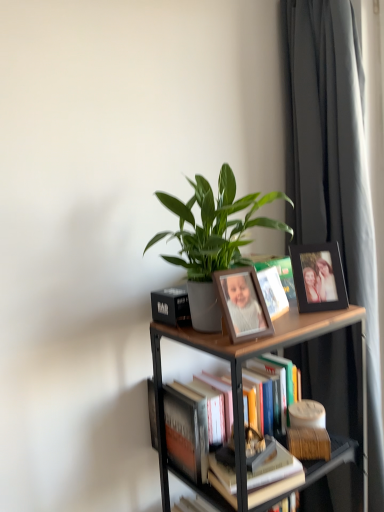
What do you see at coordinates (273, 292) in the screenshot? The height and width of the screenshot is (512, 384). I see `matte white book at center` at bounding box center [273, 292].

The width and height of the screenshot is (384, 512). Describe the element at coordinates (318, 277) in the screenshot. I see `black matte picture frame at upper right, positioned as the first picture frame in back-to-front order` at that location.

This screenshot has height=512, width=384. Describe the element at coordinates (213, 239) in the screenshot. I see `green matte plant at center` at that location.

In order to face woodenmaterial/textureshelf at upper center, should I rotate leftwards or rightwards?

It's best to rotate right around 9.128 degrees.

The image size is (384, 512). Describe the element at coordinates (274, 476) in the screenshot. I see `hardcover book at center, positioned as the 1th book in front-to-back order` at that location.

The width and height of the screenshot is (384, 512). Describe the element at coordinates (243, 304) in the screenshot. I see `wooden photo frame at center, which ranks as the first picture frame in left-to-right order` at that location.

This screenshot has width=384, height=512. Describe the element at coordinates (333, 169) in the screenshot. I see `dark gray fabric curtain at right` at that location.

What is the approximate width of dark gray fabric curtain at right?

The width of dark gray fabric curtain at right is 37.48 centimeters.

Locate an element on the screen. The image size is (384, 512). matte white book at center is located at coordinates (273, 292).

Are hardcover books at center, the 2th book when ordered from front to back, and wooden photo frame at center, the 1th picture frame positioned from the front, beside each other?

No, hardcover books at center, the 2th book when ordered from front to back, is not touching wooden photo frame at center, the 1th picture frame positioned from the front.

Between hardcover books at center, which is counted as the first book, starting from the back, and wooden photo frame at center, the 1th picture frame positioned from the front, which one has smaller width?

With smaller width is wooden photo frame at center, the 1th picture frame positioned from the front.

Could you tell me if hardcover books at center, which is counted as the first book, starting from the back, is turned towards wooden photo frame at center, which appears as the 2th picture frame when viewed from the back?

No, hardcover books at center, which is counted as the first book, starting from the back, is not aimed at wooden photo frame at center, which appears as the 2th picture frame when viewed from the back.

Is green matte plant at center completely or partially inside hardcover book at center, which is counted as the second book, starting from the back?

No, green matte plant at center is not a part of hardcover book at center, which is counted as the second book, starting from the back.

Is hardcover book at center, which is counted as the second book, starting from the back, looking in the opposite direction of green matte plant at center?

hardcover book at center, which is counted as the second book, starting from the back, does not have its back to green matte plant at center.

Looking at their sizes, would you say hardcover book at center, which is counted as the second book, starting from the back, is wider or thinner than green matte plant at center?

Considering their sizes, hardcover book at center, which is counted as the second book, starting from the back, looks slimmer than green matte plant at center.

Is hardcover books at center, the 2th book when ordered from front to back, turned away from matte white book at center?

No, matte white book at center is not at the back of hardcover books at center, the 2th book when ordered from front to back.

From the picture: Is matte white book at center completely or partially inside hardcover books at center, which is counted as the first book, starting from the back?

That's incorrect, matte white book at center is not inside hardcover books at center, which is counted as the first book, starting from the back.

Is hardcover books at center, which is counted as the first book, starting from the back, positioned behind matte white book at center?

Yes, hardcover books at center, which is counted as the first book, starting from the back, is behind matte white book at center.

Which of these two, hardcover books at center, which is counted as the first book, starting from the back, or matte white book at center, is thinner?

Thinner between the two is matte white book at center.

Considering the relative sizes of wooden photo frame at center, which ranks as the first picture frame in left-to-right order, and hardcover book at center, which is counted as the second book, starting from the back, in the image provided, is wooden photo frame at center, which ranks as the first picture frame in left-to-right order, wider than hardcover book at center, which is counted as the second book, starting from the back,?

No, wooden photo frame at center, which ranks as the first picture frame in left-to-right order, is not wider than hardcover book at center, which is counted as the second book, starting from the back.

From a real-world perspective, count 2nd books downward from the wooden photo frame at center, the 1th picture frame positioned from the front, and point to it. Please provide its 2D coordinates.

[(274, 476)]

Is wooden photo frame at center, the 1th picture frame positioned from the front, in front of or behind hardcover book at center, which is counted as the second book, starting from the back, in the image?

wooden photo frame at center, the 1th picture frame positioned from the front, is positioned closer to the viewer than hardcover book at center, which is counted as the second book, starting from the back.

From the image's perspective, which is above, green matte plant at center or hardcover book at center, which is counted as the second book, starting from the back?

green matte plant at center.

Can you confirm if green matte plant at center is positioned to the left of hardcover book at center, which is counted as the second book, starting from the back?

Yes, green matte plant at center is to the left of hardcover book at center, which is counted as the second book, starting from the back.

Can hardcover book at center, which is counted as the second book, starting from the back, be found inside green matte plant at center?

Actually, hardcover book at center, which is counted as the second book, starting from the back, is outside green matte plant at center.

Does green matte plant at center touch hardcover book at center, which is counted as the second book, starting from the back?

green matte plant at center and hardcover book at center, which is counted as the second book, starting from the back, are clearly separated.

Between hardcover books at center, which is counted as the first book, starting from the back, and dark gray fabric curtain at right, which one has more height?

dark gray fabric curtain at right is taller.

Considering the positions of objects hardcover books at center, the 2th book when ordered from front to back, and dark gray fabric curtain at right in the image provided, who is behind, hardcover books at center, the 2th book when ordered from front to back, or dark gray fabric curtain at right?

Positioned behind is hardcover books at center, the 2th book when ordered from front to back.

Between hardcover books at center, the 2th book when ordered from front to back, and dark gray fabric curtain at right, which one has smaller size?

With smaller size is hardcover books at center, the 2th book when ordered from front to back.

Measure the distance from hardcover books at center, which is counted as the first book, starting from the back, to dark gray fabric curtain at right.

hardcover books at center, which is counted as the first book, starting from the back, and dark gray fabric curtain at right are 21.84 inches apart from each other.

Looking at this image, is wooden photo frame at center, which is the second picture frame from right to left, positioned with its back to dark gray fabric curtain at right?

No, wooden photo frame at center, which is the second picture frame from right to left, is not facing the opposite direction of dark gray fabric curtain at right.

Based on the photo, is wooden photo frame at center, which is the second picture frame from right to left, in front of or behind dark gray fabric curtain at right in the image?

Clearly, wooden photo frame at center, which is the second picture frame from right to left, is in front of dark gray fabric curtain at right.

How many degrees apart are the facing directions of wooden photo frame at center, which appears as the 2th picture frame when viewed from the back, and dark gray fabric curtain at right?

wooden photo frame at center, which appears as the 2th picture frame when viewed from the back, and dark gray fabric curtain at right are facing 86.9 degrees away from each other.

From a real-world perspective, is wooden photo frame at center, which appears as the 2th picture frame when viewed from the back, physically below dark gray fabric curtain at right?

Actually, wooden photo frame at center, which appears as the 2th picture frame when viewed from the back, is physically above dark gray fabric curtain at right in the real world.

What are the coordinates of `the 2nd book behind the wooden photo frame at center, the 1th picture frame positioned from the front, counting from the anchor's position` in the screenshot? It's located at (219, 415).

What are the coordinates of `houseplant on the left of hardcover book at center, which is counted as the second book, starting from the back` in the screenshot? It's located at click(213, 239).

When comparing their distances from wooden photo frame at center, which is the second picture frame from right to left, does hardcover books at center, the 2th book when ordered from front to back, or woodenmaterial/textureshelf at upper center seem further?

hardcover books at center, the 2th book when ordered from front to back, lies further to wooden photo frame at center, which is the second picture frame from right to left, than the other object.

Estimate the real-world distances between objects in this image. Which object is closer to wooden photo frame at center, which appears as the 2th picture frame when viewed from the back, woodenmaterial/textureshelf at upper center or hardcover book at center, positioned as the 1th book in front-to-back order?

The object closer to wooden photo frame at center, which appears as the 2th picture frame when viewed from the back, is woodenmaterial/textureshelf at upper center.

From the image, which object appears to be nearer to hardcover books at center, the 2th book when ordered from front to back, matte white book at center or hardcover book at center, positioned as the 1th book in front-to-back order?

hardcover book at center, positioned as the 1th book in front-to-back order, is closer to hardcover books at center, the 2th book when ordered from front to back.

When comparing their distances from hardcover books at center, the 2th book when ordered from front to back, does green matte plant at center or wooden photo frame at center, which is the second picture frame from right to left, seem further?

green matte plant at center is further to hardcover books at center, the 2th book when ordered from front to back.

Which object lies further to the anchor point matte white book at center, green matte plant at center or woodenmaterial/textureshelf at upper center?

woodenmaterial/textureshelf at upper center is positioned further to the anchor matte white book at center.

Considering their positions, is green matte plant at center positioned closer to hardcover book at center, which is counted as the second book, starting from the back, than hardcover books at center, which is counted as the first book, starting from the back?

hardcover books at center, which is counted as the first book, starting from the back, is positioned closer to the anchor hardcover book at center, which is counted as the second book, starting from the back.

From the image, which object appears to be nearer to black matte picture frame at upper right, marked as the second picture frame in a front-to-back arrangement, woodenmaterial/textureshelf at upper center or dark gray fabric curtain at right?

The object closer to black matte picture frame at upper right, marked as the second picture frame in a front-to-back arrangement, is woodenmaterial/textureshelf at upper center.

Considering their positions, is hardcover book at center, which is counted as the second book, starting from the back, positioned closer to black matte picture frame at upper right, marked as the second picture frame in a front-to-back arrangement, than matte white book at center?

matte white book at center lies closer to black matte picture frame at upper right, marked as the second picture frame in a front-to-back arrangement, than the other object.

Where is `picture frame between dark gray fabric curtain at right and woodenmaterial/textureshelf at upper center from top to bottom`? picture frame between dark gray fabric curtain at right and woodenmaterial/textureshelf at upper center from top to bottom is located at coordinates (243, 304).

Locate an element on the screen. This screenshot has height=512, width=384. picture frame between black matte picture frame at upper right, positioned as the 1th picture frame in right-to-left order, and woodenmaterial/textureshelf at upper center, in the vertical direction is located at coordinates (243, 304).

Locate an element on the screen. The image size is (384, 512). book between hardcover books at center, which is counted as the first book, starting from the back, and dark gray fabric curtain at right is located at coordinates pyautogui.click(x=274, y=476).

At what (x,y) coordinates should I click in order to perform the action: click on book that lies between black matte picture frame at upper right, positioned as the 1th picture frame in right-to-left order, and hardcover book at center, which is counted as the second book, starting from the back, from top to bottom. Please return your answer as a coordinate pair (x, y). This screenshot has height=512, width=384. Looking at the image, I should click on (219, 415).